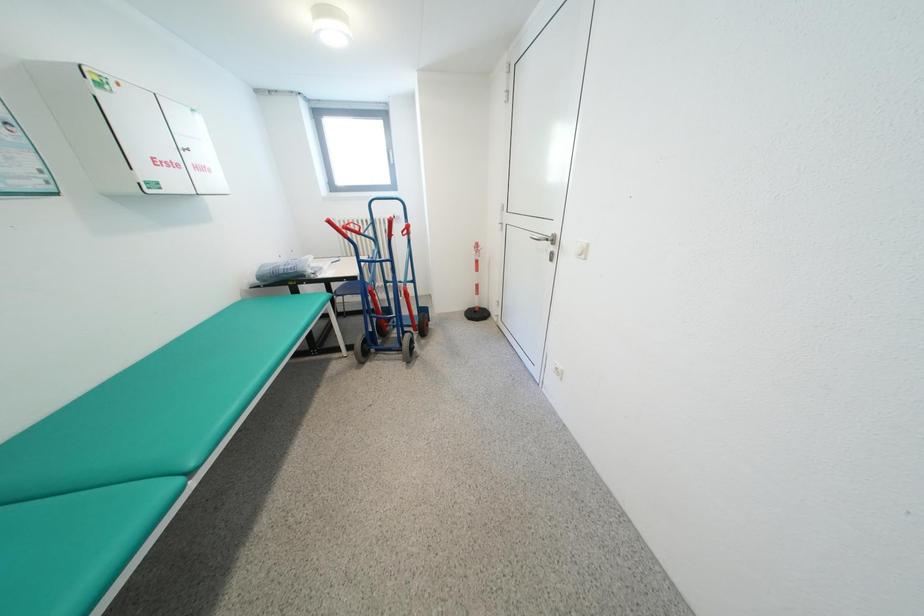
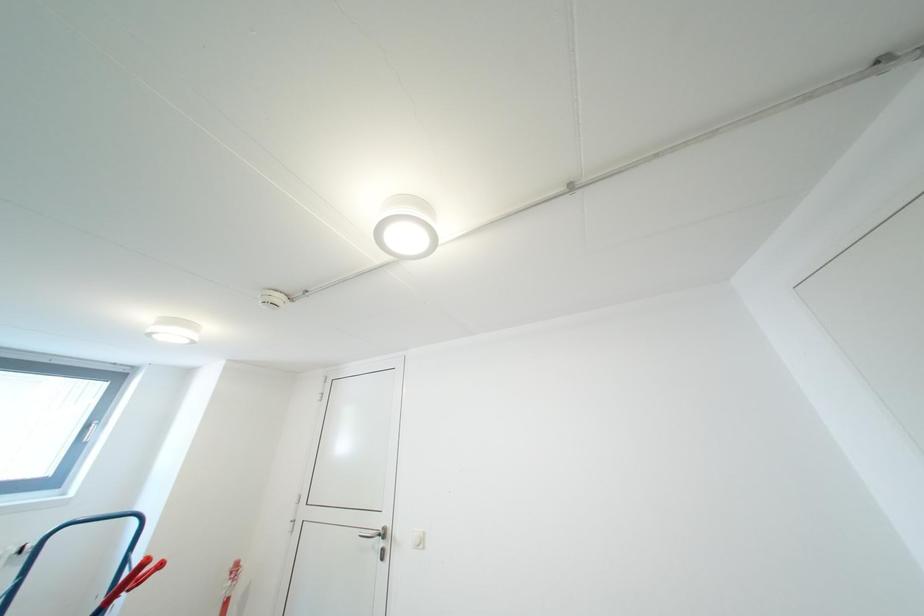
The first image is from the beginning of the video and the second image is from the end. How did the camera likely rotate when shooting the video?

The rotation direction of the camera is right-up.